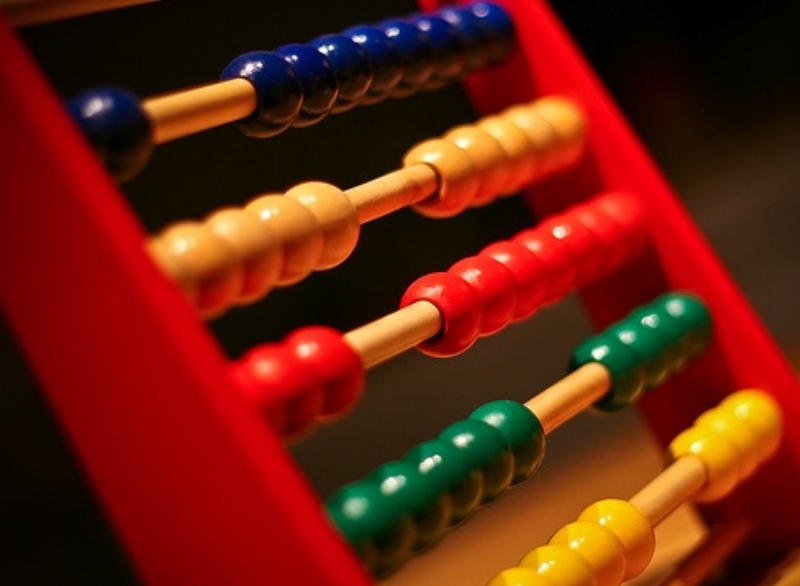
The height and width of the screenshot is (586, 800). I want to click on red abacus beads, so click(262, 393), click(297, 384), click(341, 362), click(460, 312), click(504, 289), click(520, 282), click(552, 263), click(578, 251), click(608, 236), click(628, 223).